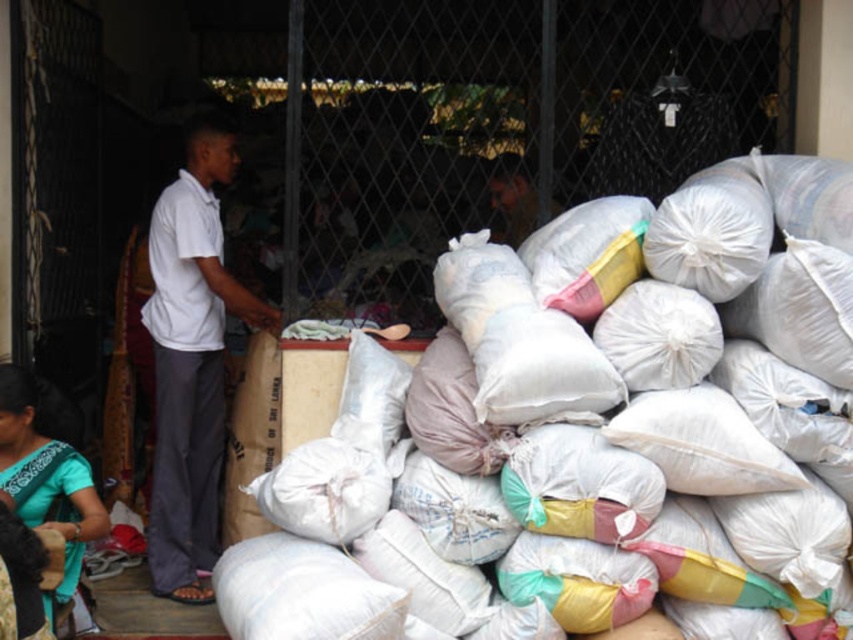
Is point (627, 417) closer to camera compared to point (61, 522)?

Yes.

Who is positioned more to the left, white fabric sack at center or teal fabric dress at lower left?

Positioned to the left is teal fabric dress at lower left.

Which is in front, point (285, 600) or point (93, 500)?

Positioned in front is point (285, 600).

Image resolution: width=853 pixels, height=640 pixels. I want to click on white fabric sack at center, so click(x=677, y=380).

Between white cotton shirt at left and teal fabric dress at lower left, which one is positioned lower?

teal fabric dress at lower left is below.

Which of these two, white cotton shirt at left or teal fabric dress at lower left, stands shorter?

teal fabric dress at lower left is shorter.

Does point (213, 468) come in front of point (47, 602)?

No, (213, 468) is further to viewer.

Where is `white cotton shirt at left`? This screenshot has height=640, width=853. white cotton shirt at left is located at coordinates (190, 360).

Is point (735, 397) in front of point (218, 272)?

Yes, it is.

Based on the photo, does white fabric sack at center have a lesser height compared to white cotton shirt at left?

Yes, white fabric sack at center is shorter than white cotton shirt at left.

Does point (798, 472) come farther from viewer compared to point (154, 342)?

No, it is not.

Where is `white fabric sack at center`? This screenshot has width=853, height=640. white fabric sack at center is located at coordinates (677, 380).